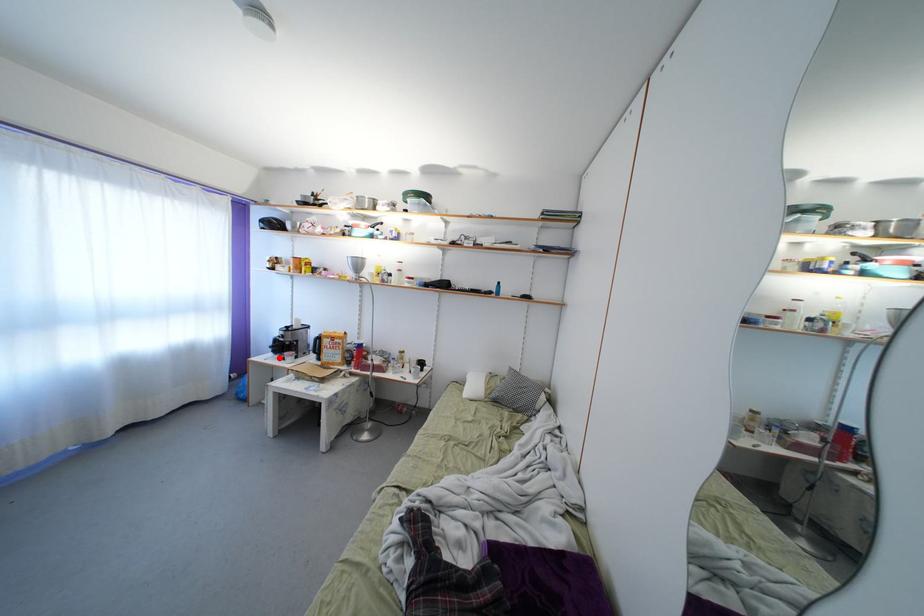
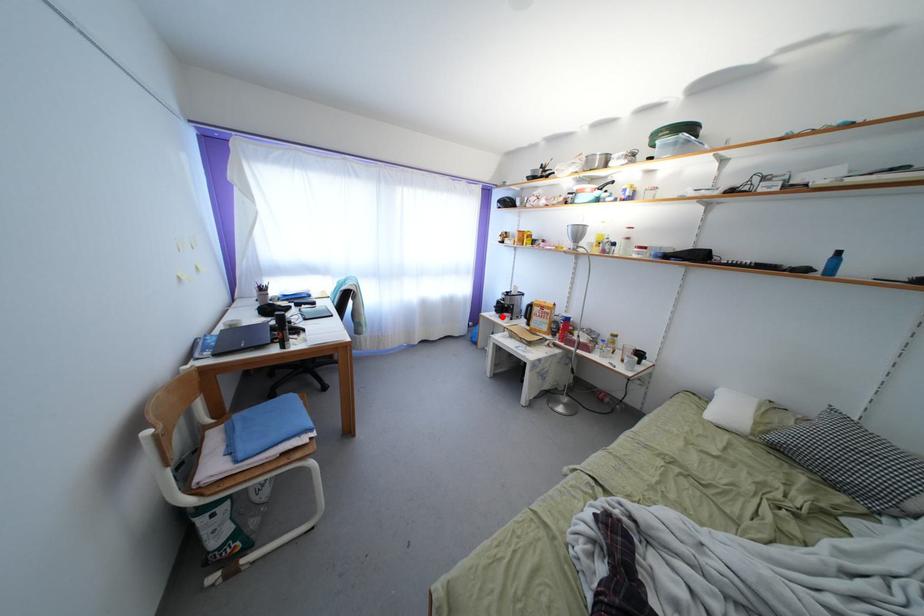
I am providing you with two images of the same scene from different viewpoints. A red point is marked on the first image and another point is marked on the second image. Does the point marked in image1 correspond to the same location as the one in image2?

Yes